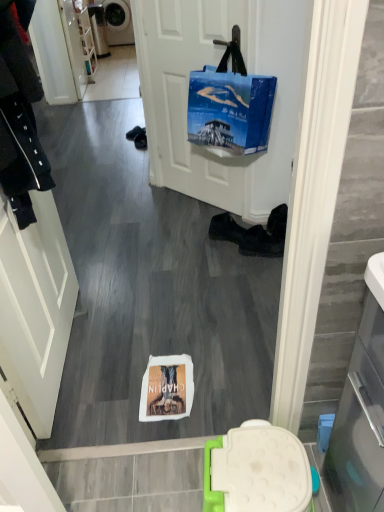
Identify the location of free space below white paper bag at center (from a real-world perspective). The width and height of the screenshot is (384, 512). [157, 382].